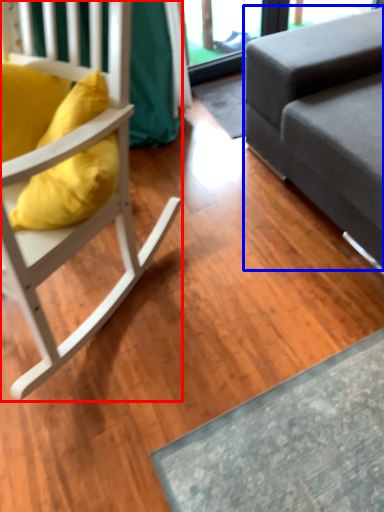
Question: Which object appears closest to the camera in this image, chair (highlighted by a red box) or studio couch (highlighted by a blue box)?

Choices:
 (A) chair
 (B) studio couch

Answer: (A)